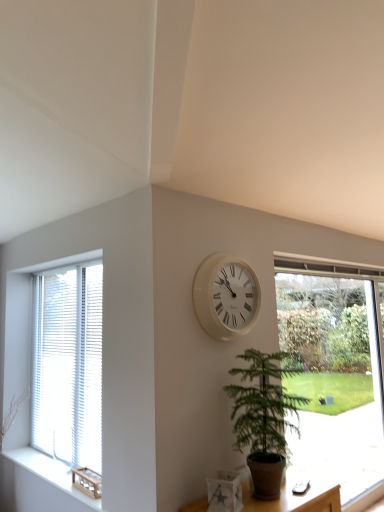
Question: Is green leafy plant at center at the right side of white wood blinds at left, which is counted as the 2th window, starting from the right?

Choices:
 (A) no
 (B) yes

Answer: (B)

Question: Is green leafy plant at center bigger than white wood blinds at left, acting as the first window starting from the left?

Choices:
 (A) no
 (B) yes

Answer: (B)

Question: From the image's perspective, is green leafy plant at center below white wood blinds at left, acting as the first window starting from the left?

Choices:
 (A) no
 (B) yes

Answer: (B)

Question: Would you say green leafy plant at center contains white wood blinds at left, which is counted as the 2th window, starting from the right?

Choices:
 (A) no
 (B) yes

Answer: (A)

Question: Would you say green leafy plant at center is outside white wood blinds at left, which is counted as the 2th window, starting from the right?

Choices:
 (A) no
 (B) yes

Answer: (B)

Question: In the image, is transparent glass window at right, arranged as the second window when viewed from the left, positioned in front of or behind green leafy plant at center?

Choices:
 (A) front
 (B) behind

Answer: (B)

Question: In terms of width, does transparent glass window at right, arranged as the second window when viewed from the left, look wider or thinner when compared to green leafy plant at center?

Choices:
 (A) wide
 (B) thin

Answer: (B)

Question: From their relative heights in the image, would you say transparent glass window at right, arranged as the second window when viewed from the left, is taller or shorter than green leafy plant at center?

Choices:
 (A) short
 (B) tall

Answer: (B)

Question: Based on their sizes in the image, would you say transparent glass window at right, arranged as the second window when viewed from the left, is bigger or smaller than green leafy plant at center?

Choices:
 (A) big
 (B) small

Answer: (A)

Question: Do you think white matte vase at lower center is within woodenmaterial/texturewindow sill at left, or outside of it?

Choices:
 (A) inside
 (B) outside

Answer: (B)

Question: Considering the positions of white matte vase at lower center and woodenmaterial/texturewindow sill at left in the image, is white matte vase at lower center taller or shorter than woodenmaterial/texturewindow sill at left?

Choices:
 (A) tall
 (B) short

Answer: (A)

Question: Relative to woodenmaterial/texturewindow sill at left, is white matte vase at lower center in front or behind?

Choices:
 (A) front
 (B) behind

Answer: (A)

Question: Considering the positions of white matte vase at lower center and woodenmaterial/texturewindow sill at left in the image, is white matte vase at lower center wider or thinner than woodenmaterial/texturewindow sill at left?

Choices:
 (A) thin
 (B) wide

Answer: (B)

Question: Do you think white plastic clock at center is within woodenmaterial/texturewindow sill at left, or outside of it?

Choices:
 (A) outside
 (B) inside

Answer: (A)

Question: Does point (198, 285) appear closer or farther from the camera than point (66, 501)?

Choices:
 (A) farther
 (B) closer

Answer: (B)